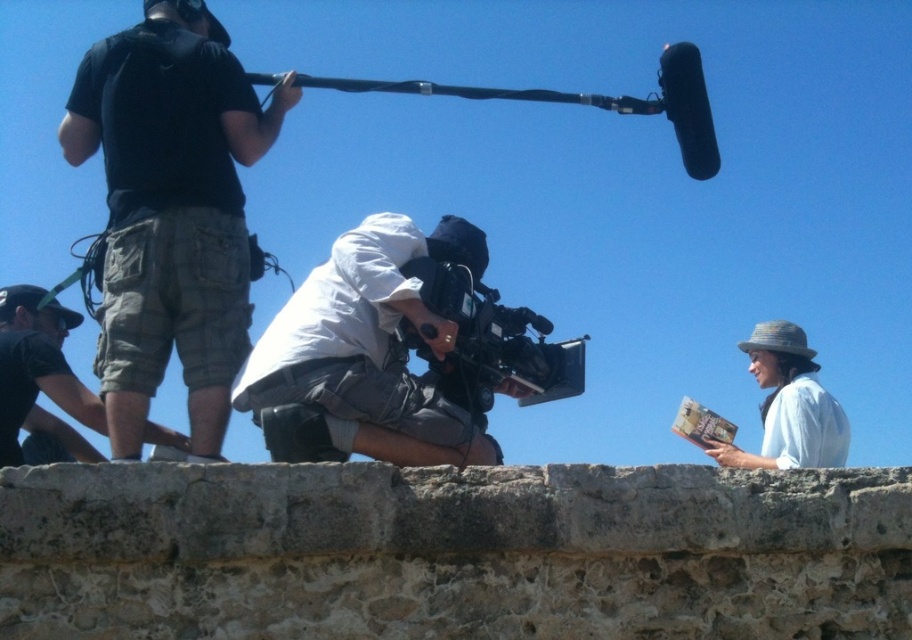
Which is above, white matte camera at center or white woven hat at right?

white matte camera at center is above.

Who is lower down, white matte camera at center or white woven hat at right?

white woven hat at right

Which is behind, point (347, 266) or point (828, 452)?

The point (828, 452) is more distant.

Image resolution: width=912 pixels, height=640 pixels. I want to click on white matte camera at center, so click(x=364, y=355).

Does black matte shirt at upper left have a smaller size compared to dark gray cargo shorts at left?

Actually, black matte shirt at upper left might be larger than dark gray cargo shorts at left.

Who is positioned more to the right, black matte shirt at upper left or dark gray cargo shorts at left?

black matte shirt at upper left is more to the right.

This screenshot has width=912, height=640. In order to click on black matte shirt at upper left in this screenshot , I will do `click(171, 211)`.

Is point (117, 246) closer to viewer compared to point (755, 364)?

Yes, point (117, 246) is closer to viewer.

Can you confirm if black matte shirt at upper left is positioned to the left of white woven hat at right?

Indeed, black matte shirt at upper left is positioned on the left side of white woven hat at right.

Is point (75, 152) closer to viewer compared to point (809, 397)?

Yes, it is.

Identify the location of black matte shirt at upper left. (171, 211).